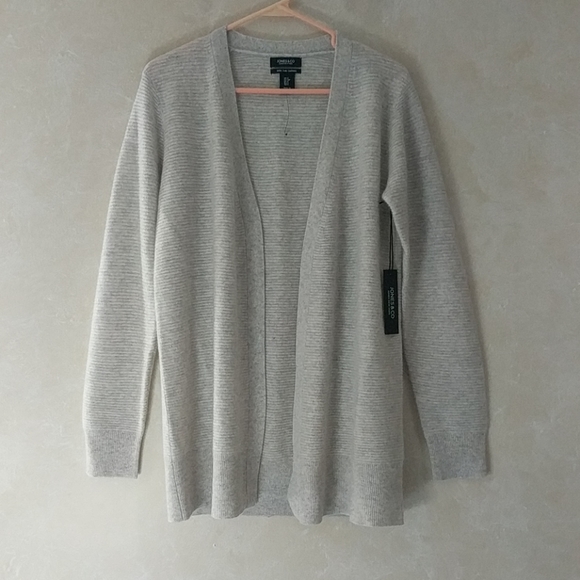
At what (x,y) coordinates should I click in order to perform the action: click on hanger. Please return your answer as a coordinate pair (x, y). Image resolution: width=580 pixels, height=580 pixels. Looking at the image, I should click on (253, 13).